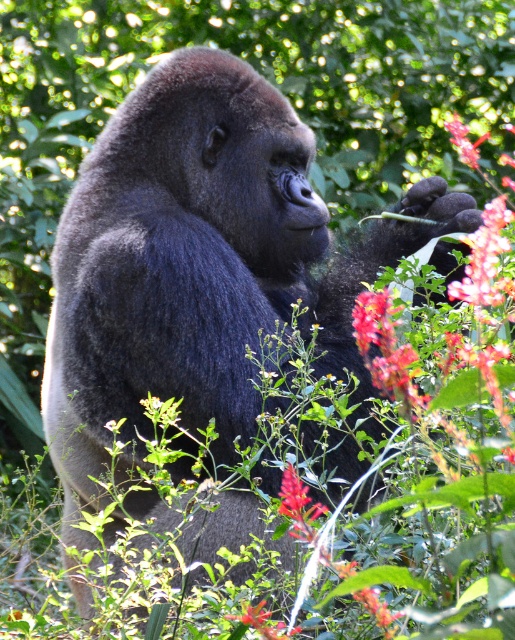
Question: Which object is farther from the camera taking this photo?

Choices:
 (A) vivid crimson petals at upper right
 (B) vibrant red petals at center

Answer: (A)

Question: Among these objects, which one is nearest to the camera?

Choices:
 (A) vibrant pink petals at center
 (B) vivid crimson petals at upper right
 (C) vibrant red petals at center

Answer: (C)

Question: From the image, what is the correct spatial relationship of vibrant red petals at center in relation to vibrant pink petals at center?

Choices:
 (A) below
 (B) above

Answer: (A)

Question: Which of the following is the closest to the observer?

Choices:
 (A) (269, 625)
 (B) (496, 298)

Answer: (A)

Question: Is vivid crimson petals at upper right in front of vibrant red petals at center?

Choices:
 (A) yes
 (B) no

Answer: (B)

Question: Considering the relative positions of vivid crimson petals at upper right and vibrant pink petals at center in the image provided, where is vivid crimson petals at upper right located with respect to vibrant pink petals at center?

Choices:
 (A) above
 (B) below

Answer: (B)